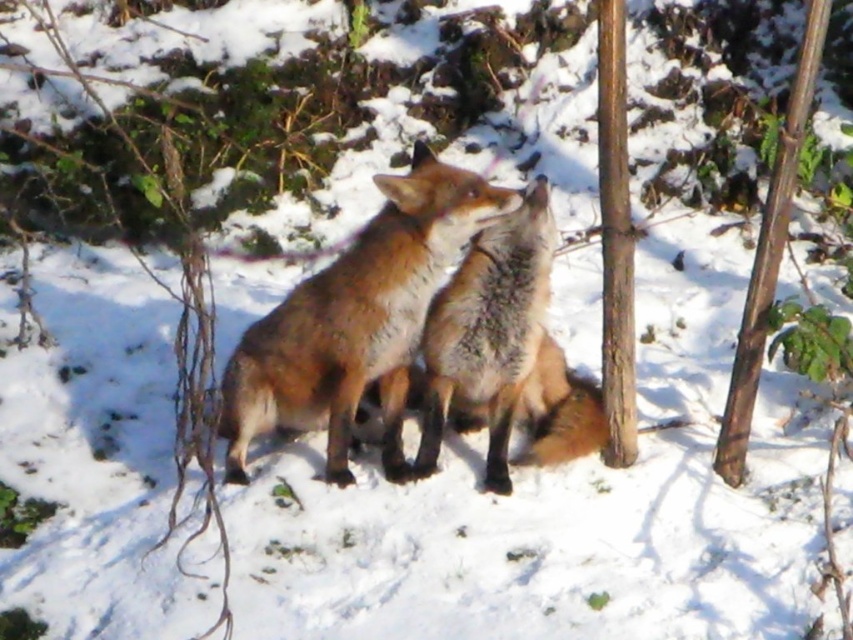
You are a photographer trying to capture the brown fur fox at center in a winter landscape. Based on the scene, where should you position your camera to ensure the fox is centered in your shot?

To center the brown fur fox at center in your shot, position your camera so that the fox is aligned with the point at coordinates 0.502 on the x axis and 0.419 on the y axis.

You are a hiker trying to determine the distance between two poles in a snowy forest. You see a smooth brown pole at right and a brown wood pole at center. Which pole is closer to you?

The smooth brown pole at right is closer to you because the brown wood pole at center is behind it.

You are a hiker who needs to use a pole for support while walking on a slippery path. You see the smooth brown pole at right and the brown wood pole at center. Which pole is more suitable for providing stability?

The smooth brown pole at right is larger in size than the brown wood pole at center, making it more suitable for providing stability due to its greater size and possibly better grip.